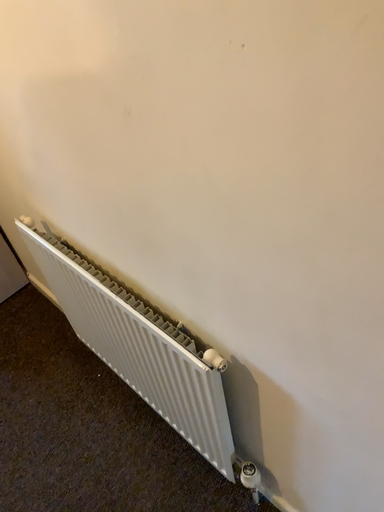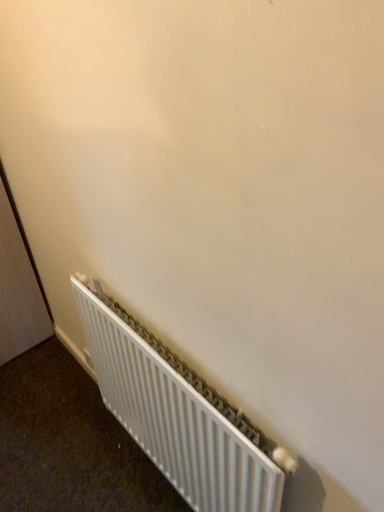
Question: How did the camera likely rotate when shooting the video?

Choices:
 (A) rotated upward
 (B) rotated downward

Answer: (A)